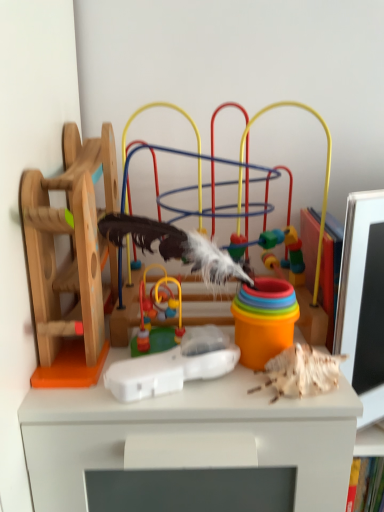
Question: Is smooth plastic toy at center, placed as the second toy when sorted from left to right, shorter than multicolored plastic toy at center, which appears as the fourth toy when viewed from the left?

Choices:
 (A) no
 (B) yes

Answer: (B)

Question: From the image's perspective, does smooth plastic toy at center, placed as the second toy when sorted from left to right, appear higher than multicolored plastic toy at center, which appears as the fourth toy when viewed from the left?

Choices:
 (A) no
 (B) yes

Answer: (A)

Question: From a real-world perspective, is smooth plastic toy at center, placed as the second toy when sorted from left to right, positioned over multicolored plastic toy at center, which appears as the fourth toy when viewed from the left, based on gravity?

Choices:
 (A) no
 (B) yes

Answer: (A)

Question: Can you confirm if smooth plastic toy at center, placed as the 3th toy when sorted from right to left, is thinner than multicolored plastic toy at center, the 1th toy positioned from the right?

Choices:
 (A) no
 (B) yes

Answer: (B)

Question: Does smooth plastic toy at center, placed as the second toy when sorted from left to right, have a greater width compared to multicolored plastic toy at center, which appears as the fourth toy when viewed from the left?

Choices:
 (A) yes
 (B) no

Answer: (B)

Question: From the image's perspective, is smooth plastic toy at center, placed as the second toy when sorted from left to right, under multicolored plastic toy at center, the 1th toy positioned from the right?

Choices:
 (A) yes
 (B) no

Answer: (A)

Question: Is wooden toy at left, acting as the 4th toy starting from the right, outside smooth plastic toy at center, placed as the second toy when sorted from left to right?

Choices:
 (A) no
 (B) yes

Answer: (B)

Question: Is the position of wooden toy at left, acting as the 4th toy starting from the right, more distant than that of smooth plastic toy at center, placed as the second toy when sorted from left to right?

Choices:
 (A) no
 (B) yes

Answer: (A)

Question: Considering the relative positions of wooden toy at left, acting as the 4th toy starting from the right, and smooth plastic toy at center, placed as the 3th toy when sorted from right to left, in the image provided, is wooden toy at left, acting as the 4th toy starting from the right, in front of smooth plastic toy at center, placed as the 3th toy when sorted from right to left,?

Choices:
 (A) yes
 (B) no

Answer: (A)

Question: Is wooden toy at left, acting as the 4th toy starting from the right, positioned with its back to smooth plastic toy at center, placed as the 3th toy when sorted from right to left?

Choices:
 (A) no
 (B) yes

Answer: (A)

Question: Does wooden toy at left, marked as the 1th toy in a left-to-right arrangement, have a larger size compared to smooth plastic toy at center, placed as the 3th toy when sorted from right to left?

Choices:
 (A) no
 (B) yes

Answer: (B)

Question: From the image's perspective, is wooden toy at left, marked as the 1th toy in a left-to-right arrangement, above smooth plastic toy at center, placed as the second toy when sorted from left to right?

Choices:
 (A) yes
 (B) no

Answer: (A)

Question: Is multicolored plastic toy at center, which appears as the fourth toy when viewed from the left, completely or partially outside of white plastic remote at center, arranged as the second toy when viewed from the right?

Choices:
 (A) yes
 (B) no

Answer: (A)